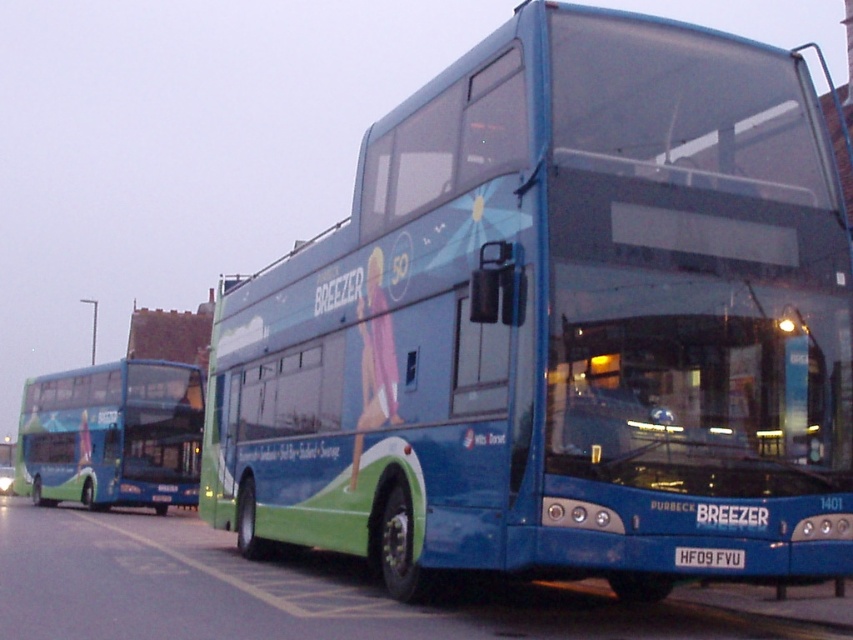
You are a pedestrian standing in front of the two buses. Which bus is nearer to you, the blue metallic bus at center or the blue glossy bus at left?

The blue metallic bus at center is closer to the viewer than the blue glossy bus at left.

You are standing in front of the two double decker buses and want to place a sticker on the nearest point between point 1 at coordinate point (397, 394) and point 2 at coordinate point (711, 566). Which point should you choose?

You should choose point 1 at coordinate point (397, 394) because it is closer to you than point 2 at coordinate point (711, 566).

What is the spatial relationship between the blue glossy bus at left and the white plastic license plate at center in the scene?

The blue glossy bus at left is located below the white plastic license plate at center.